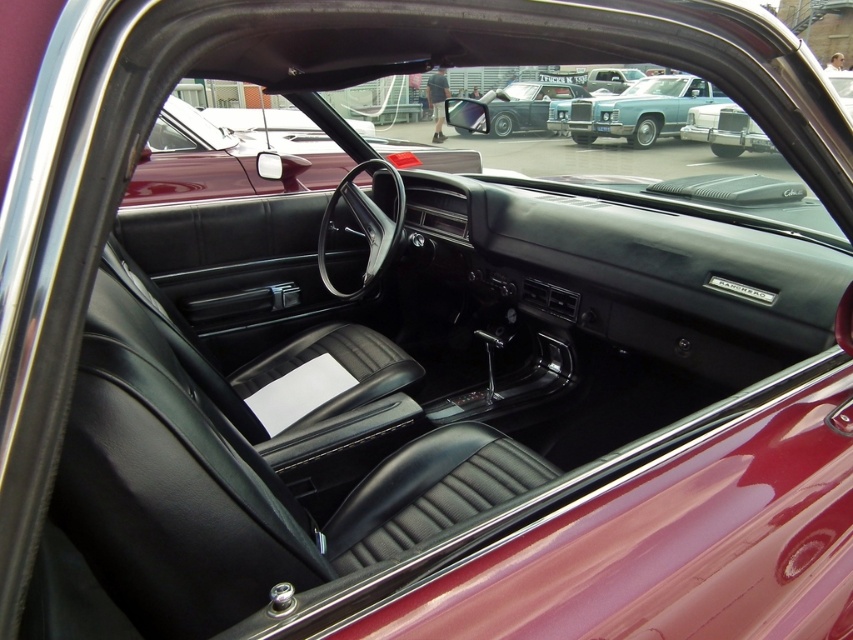
Question: Which of the following is the closest to the observer?

Choices:
 (A) shiny chrome car at upper center
 (B) glossy maroon car at center

Answer: (B)

Question: Does glossy maroon car at center appear under shiny chrome car at upper center?

Choices:
 (A) no
 (B) yes

Answer: (B)

Question: Among these points, which one is nearest to the camera?

Choices:
 (A) (440, 150)
 (B) (583, 120)
 (C) (734, 120)
 (D) (544, 128)

Answer: (A)

Question: Is the position of shiny chrome car at upper center less distant than that of metallic silver car at upper right?

Choices:
 (A) yes
 (B) no

Answer: (A)

Question: Which object appears closest to the camera in this image?

Choices:
 (A) shiny chrome car at upper center
 (B) shiny blue sedan at upper center
 (C) metallic silver car at upper right
 (D) glossy maroon car at center

Answer: (D)

Question: Does glossy maroon car at center have a smaller size compared to metallic silver car at upper right?

Choices:
 (A) yes
 (B) no

Answer: (B)